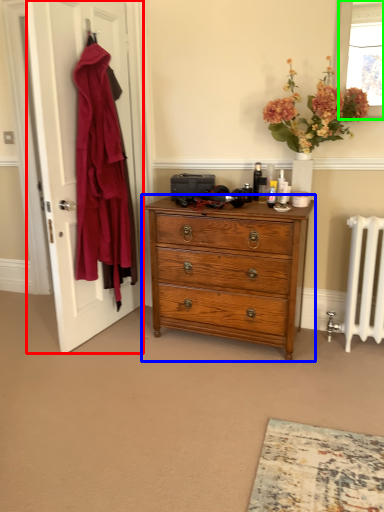
Question: Which object is the farthest from door (highlighted by a red box)? Choose among these: chest of drawers (highlighted by a blue box) or window screen (highlighted by a green box).

Choices:
 (A) chest of drawers
 (B) window screen

Answer: (B)